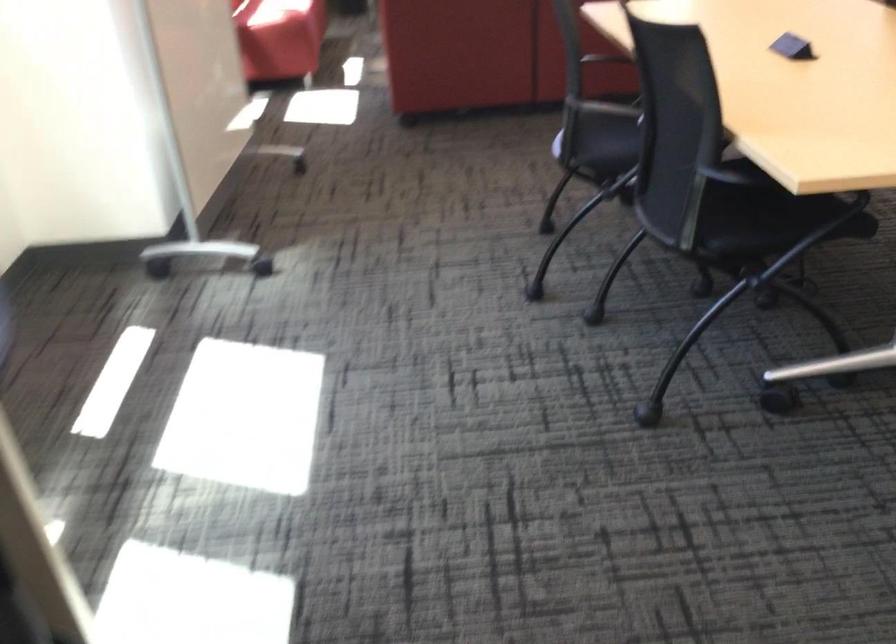
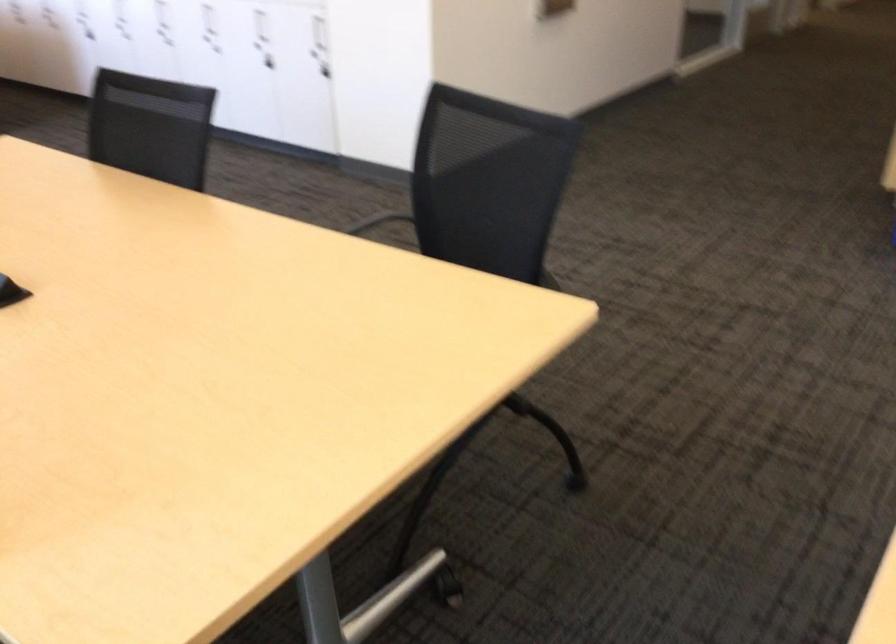
Question: The images are taken continuously from a first-person perspective. In which direction is your viewpoint rotating?

Choices:
 (A) Left
 (B) Right
 (C) Up
 (D) Down

Answer: (B)